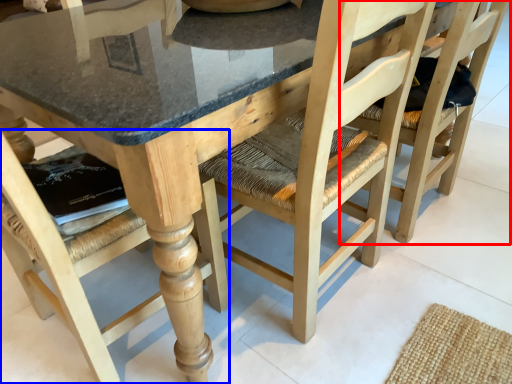
Question: Which of the following is the closest to the observer, chair (highlighted by a red box) or chair (highlighted by a blue box)?

Choices:
 (A) chair
 (B) chair

Answer: (B)